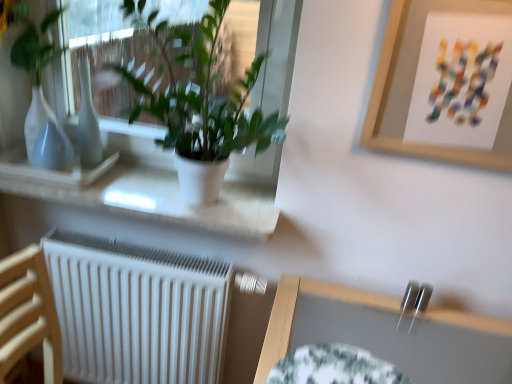
Question: Considering the relative sizes of white matte radiator at lower left and matte white vase at left, acting as the second vase starting from the right, in the image provided, is white matte radiator at lower left smaller than matte white vase at left, acting as the second vase starting from the right,?

Choices:
 (A) no
 (B) yes

Answer: (A)

Question: Are white matte radiator at lower left and matte white vase at left, the 1th vase in the left-to-right sequence, making contact?

Choices:
 (A) yes
 (B) no

Answer: (B)

Question: Is white matte radiator at lower left oriented towards matte white vase at left, the 1th vase in the left-to-right sequence?

Choices:
 (A) no
 (B) yes

Answer: (A)

Question: Is white matte radiator at lower left turned away from matte white vase at left, the 1th vase in the left-to-right sequence?

Choices:
 (A) no
 (B) yes

Answer: (A)

Question: From a real-world perspective, does white matte radiator at lower left sit lower than matte white vase at left, the 1th vase in the left-to-right sequence?

Choices:
 (A) yes
 (B) no

Answer: (A)

Question: Considering the positions of white glossy vase at left, which is the 1th houseplant from left to right, and white glossy vase at upper left, the first vase when ordered from right to left, in the image, is white glossy vase at left, which is the 1th houseplant from left to right, taller or shorter than white glossy vase at upper left, the first vase when ordered from right to left,?

Choices:
 (A) tall
 (B) short

Answer: (A)

Question: From the image's perspective, relative to white glossy vase at upper left, the first vase when ordered from right to left, is white glossy vase at left, which is the 1th houseplant from left to right, above or below?

Choices:
 (A) below
 (B) above

Answer: (B)

Question: Does point (38, 105) appear closer or farther from the camera than point (100, 142)?

Choices:
 (A) closer
 (B) farther

Answer: (A)

Question: Considering the positions of white glossy vase at left, the 2th houseplant when ordered from right to left, and white glossy vase at upper left, the second vase in the left-to-right sequence, in the image, is white glossy vase at left, the 2th houseplant when ordered from right to left, bigger or smaller than white glossy vase at upper left, the second vase in the left-to-right sequence,?

Choices:
 (A) small
 (B) big

Answer: (B)

Question: From the image's perspective, is white matte radiator at lower left above or below matte white vase at left, acting as the second vase starting from the right?

Choices:
 (A) below
 (B) above

Answer: (A)

Question: Considering the positions of white matte radiator at lower left and matte white vase at left, acting as the second vase starting from the right, in the image, is white matte radiator at lower left wider or thinner than matte white vase at left, acting as the second vase starting from the right,?

Choices:
 (A) thin
 (B) wide

Answer: (B)

Question: From a real-world perspective, is white matte radiator at lower left physically located above or below matte white vase at left, acting as the second vase starting from the right?

Choices:
 (A) above
 (B) below

Answer: (B)

Question: Is white matte radiator at lower left inside the boundaries of matte white vase at left, the 1th vase in the left-to-right sequence, or outside?

Choices:
 (A) inside
 (B) outside

Answer: (B)

Question: In terms of height, does white matte plant pot at upper left, which is the first houseplant in right-to-left order, look taller or shorter compared to white glossy vase at left, which is the 1th houseplant from left to right?

Choices:
 (A) tall
 (B) short

Answer: (A)

Question: Do you think white matte plant pot at upper left, acting as the 2th houseplant starting from the left, is within white glossy vase at left, which is the 1th houseplant from left to right, or outside of it?

Choices:
 (A) outside
 (B) inside

Answer: (A)